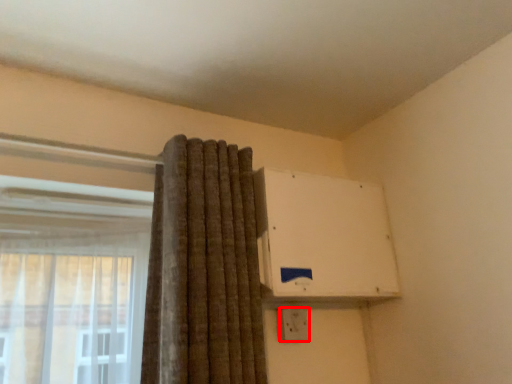
Question: From the image's perspective, considering the relative positions of electric outlet (annotated by the red box) and air conditioning in the image provided, where is electric outlet (annotated by the red box) located with respect to the staircase?

Choices:
 (A) above
 (B) below

Answer: (B)